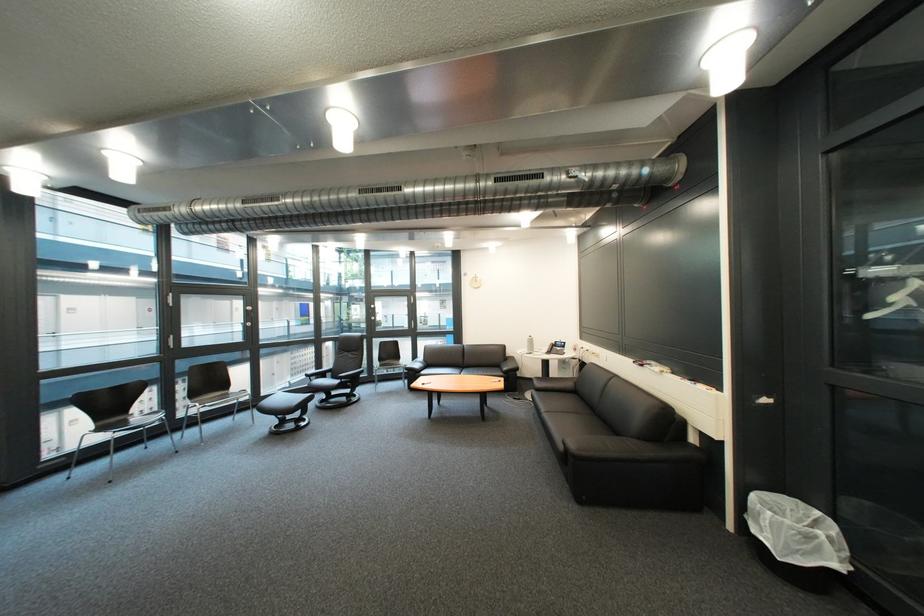
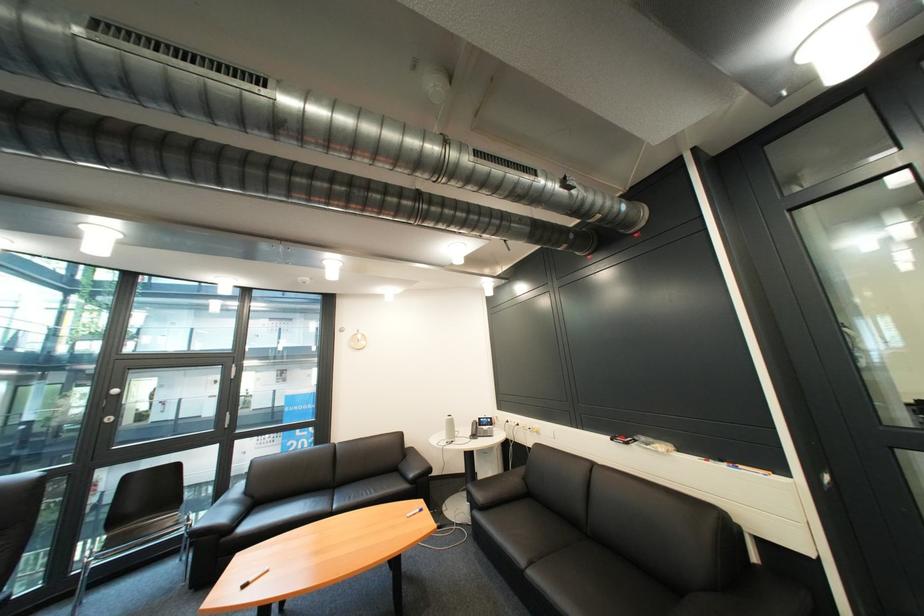
In the second image, find the point that corresponds to [611,359] in the first image.

(549, 435)